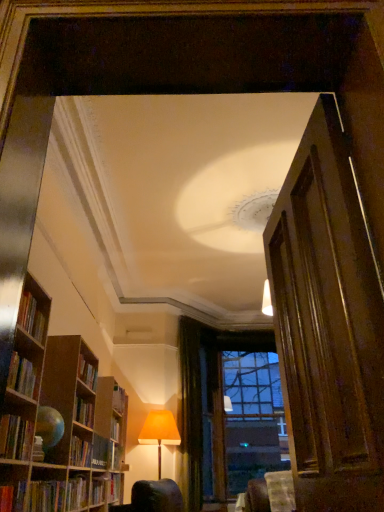
Describe the element at coordinates (240, 411) in the screenshot. I see `clear glass window at center` at that location.

In order to click on clear glass window at center in this screenshot , I will do `click(240, 411)`.

What do you see at coordinates (22, 376) in the screenshot? The width and height of the screenshot is (384, 512). I see `hardcover book at left, the 4th book from the back` at bounding box center [22, 376].

The image size is (384, 512). What do you see at coordinates (107, 488) in the screenshot? I see `hardcover book at lower left, which is the 5th book from front to back` at bounding box center [107, 488].

Identify the location of hardcover book at lower left, positioned as the first book in bottom-to-top order. (107, 488).

Where is `orange fabric lampshade at lower center`? This screenshot has height=512, width=384. orange fabric lampshade at lower center is located at coordinates (159, 432).

Where is `clear glass window at center`? clear glass window at center is located at coordinates (240, 411).

How different are the orientations of hardcover book at left, which is the 1th book in top-to-bottom order, and hardcover book at left, positioned as the 4th book in bottom-to-top order, in degrees?

0.000937 degrees.

Is hardcover book at left, the third book viewed from the back, next to hardcover book at left, the 2th book in the front-to-back sequence?

hardcover book at left, the third book viewed from the back, and hardcover book at left, the 2th book in the front-to-back sequence, are not in contact.

Is hardcover book at left, which is the fifth book from bottom to top, inside the boundaries of hardcover book at left, acting as the 2th book starting from the top, or outside?

hardcover book at left, which is the fifth book from bottom to top, is not inside hardcover book at left, acting as the 2th book starting from the top, it's outside.

Considering the positions of objects hardcover book at left, which is the fifth book from bottom to top, and hardcover book at left, acting as the 2th book starting from the top, in the image provided, who is more to the right, hardcover book at left, which is the fifth book from bottom to top, or hardcover book at left, acting as the 2th book starting from the top,?

hardcover book at left, acting as the 2th book starting from the top.

Which of these two, orange fabric lampshade at lower center or hardcover book at left, the third book viewed from the back, stands taller?

orange fabric lampshade at lower center.

Is hardcover book at left, which is the fifth book from bottom to top, a part of orange fabric lampshade at lower center?

That's incorrect, hardcover book at left, which is the fifth book from bottom to top, is not inside orange fabric lampshade at lower center.

From the image's perspective, between orange fabric lampshade at lower center and hardcover book at left, the third book viewed from the back, who is located below?

orange fabric lampshade at lower center.

Does orange fabric lampshade at lower center have a larger size compared to hardcover book at left, the third book viewed from the back?

Indeed, orange fabric lampshade at lower center has a larger size compared to hardcover book at left, the third book viewed from the back.

Between orange fabric lampshade at lower center and hardcover book at lower left, positioned as the first book in bottom-to-top order, which one has more height?

orange fabric lampshade at lower center is taller.

I want to click on book that is the 2nd object directly below the orange fabric lampshade at lower center (from a real-world perspective), so click(107, 488).

Looking at this image, would you say orange fabric lampshade at lower center is to the left or to the right of clear glass window at center in the picture?

Clearly, orange fabric lampshade at lower center is on the left of clear glass window at center in the image.

Measure the distance between orange fabric lampshade at lower center and clear glass window at center.

orange fabric lampshade at lower center and clear glass window at center are 1.20 meters apart from each other.

Image resolution: width=384 pixels, height=512 pixels. Identify the location of table lamp that appears above the clear glass window at center (from the image's perspective). (159, 432).

Which is in front, point (170, 423) or point (221, 368)?

The point (221, 368) is closer.

From the image's perspective, which one is positioned lower, hardcover book at left, arranged as the third book when viewed from the front, or wooden door at right?

hardcover book at left, arranged as the third book when viewed from the front, is shown below in the image.

Is hardcover book at left, arranged as the third book when viewed from the front, positioned before wooden door at right?

No, the depth of hardcover book at left, arranged as the third book when viewed from the front, is greater than that of wooden door at right.

From a real-world perspective, between hardcover book at left, which is the 1th book in top-to-bottom order, and wooden door at right, who is vertically lower?

wooden door at right is physically lower.

Can you confirm if hardcover book at left, which is the 1th book in top-to-bottom order, is shorter than wooden door at right?

Yes, hardcover book at left, which is the 1th book in top-to-bottom order, is shorter than wooden door at right.

Considering the relative sizes of wooden bookcase at left and hardcover book at lower left, which is the 2th book from bottom to top, in the image provided, is wooden bookcase at left smaller than hardcover book at lower left, which is the 2th book from bottom to top,?

No, wooden bookcase at left is not smaller than hardcover book at lower left, which is the 2th book from bottom to top.

Find the location of a particular element. The image size is (384, 512). bookcase above the hardcover book at lower left, which is the 2th book from bottom to top (from a real-world perspective) is located at coordinates (57, 415).

Looking at this image, is wooden bookcase at left facing away from hardcover book at lower left, arranged as the fourth book when viewed from the front?

That's right, wooden bookcase at left is facing away from hardcover book at lower left, arranged as the fourth book when viewed from the front.

Could hardcover book at lower left, marked as the second book in a back-to-front arrangement, be considered to be inside wooden bookcase at left?

Yes, hardcover book at lower left, marked as the second book in a back-to-front arrangement, is surrounded by wooden bookcase at left.

Which of these two, wooden bookcase at left or hardcover book at left, the third book viewed from the back, is thinner?

Thinner between the two is hardcover book at left, the third book viewed from the back.

Find the location of `the 2nd book directly above the wooden bookcase at left (from a real-world perspective)`. the 2nd book directly above the wooden bookcase at left (from a real-world perspective) is located at coordinates (32, 317).

Does wooden bookcase at left appear on the left side of hardcover book at left, the third book viewed from the back?

Yes.

From the image's perspective, which one is positioned higher, wooden bookcase at left or hardcover book at left, which is the 1th book in top-to-bottom order?

hardcover book at left, which is the 1th book in top-to-bottom order, from the image's perspective.

Image resolution: width=384 pixels, height=512 pixels. Find the location of `book that is the 1st object directly below the hardcover book at left, arranged as the third book when viewed from the front (from a real-world perspective)`. book that is the 1st object directly below the hardcover book at left, arranged as the third book when viewed from the front (from a real-world perspective) is located at coordinates (22, 376).

Identify the location of the 3rd book in front of the orange fabric lampshade at lower center, counting from the anchor's position. (32, 317).

Based on their spatial positions, is hardcover book at lower left, the fifth book when ordered from top to bottom, or hardcover book at left, the 4th book from the back, closer to wooden bookcase at left?

hardcover book at lower left, the fifth book when ordered from top to bottom.

Looking at this image, estimate the real-world distances between objects in this image. Which object is further from clear glass window at center, wooden door at right or hardcover book at lower left, the fifth book when ordered from top to bottom?

wooden door at right lies further to clear glass window at center than the other object.

Which object lies nearer to the anchor point clear glass window at center, hardcover book at left, the 4th book from the back, or hardcover book at lower left, marked as the second book in a back-to-front arrangement?

Based on the image, hardcover book at lower left, marked as the second book in a back-to-front arrangement, appears to be nearer to clear glass window at center.

Based on the photo, from the image, which object appears to be farther from clear glass window at center, hardcover book at lower left, which is the 2th book from bottom to top, or green velvet curtain at center?

hardcover book at lower left, which is the 2th book from bottom to top.

Considering their positions, is hardcover book at left, positioned as the 4th book in bottom-to-top order, positioned further to wooden bookcase at left than green velvet curtain at center?

green velvet curtain at center is further to wooden bookcase at left.

Looking at the image, which one is located further to hardcover book at left, which appears as the third book when ordered from the bottom, hardcover book at left, arranged as the third book when viewed from the front, or wooden door at right?

wooden door at right.

Looking at the image, which one is located closer to wooden bookcase at left, hardcover book at lower left, which is the 5th book from front to back, or clear glass window at center?

hardcover book at lower left, which is the 5th book from front to back, is closer to wooden bookcase at left.

From the image, which object appears to be farther from wooden door at right, hardcover book at left, which is the fifth book from bottom to top, or hardcover book at lower left, positioned as the first book in bottom-to-top order?

hardcover book at lower left, positioned as the first book in bottom-to-top order, is positioned further to the anchor wooden door at right.

The height and width of the screenshot is (512, 384). In order to click on book between hardcover book at left, the 1th book in the front-to-back sequence, and wooden bookcase at left vertically in this screenshot , I will do `click(45, 496)`.

At what (x,y) coordinates should I click in order to perform the action: click on curtain between hardcover book at left, the third book viewed from the back, and clear glass window at center, along the z-axis. Please return your answer as a coordinate pair (x, y). The height and width of the screenshot is (512, 384). Looking at the image, I should click on (190, 414).

The image size is (384, 512). I want to click on table lamp between hardcover book at left, the 2th book in the front-to-back sequence, and clear glass window at center, along the z-axis, so click(x=159, y=432).

Find the location of a particular element. This screenshot has width=384, height=512. table lamp between hardcover book at left, which appears as the third book when ordered from the bottom, and green velvet curtain at center, along the z-axis is located at coordinates (159, 432).